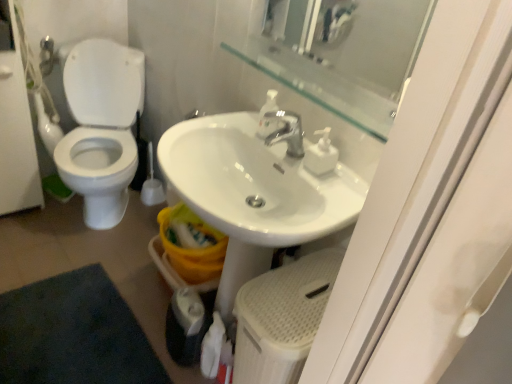
The height and width of the screenshot is (384, 512). What do you see at coordinates (255, 183) in the screenshot?
I see `white glossy sink at center` at bounding box center [255, 183].

Describe the element at coordinates (16, 133) in the screenshot. I see `white glossy screen door at left` at that location.

This screenshot has height=384, width=512. Find the location of `white textured step stool at lower center`. white textured step stool at lower center is located at coordinates (282, 318).

What do you see at coordinates (321, 154) in the screenshot? I see `white plastic soap dispenser at center, which is the 2th soap dispenser in left-to-right order` at bounding box center [321, 154].

Where is `white plastic brush at left`? This screenshot has height=384, width=512. white plastic brush at left is located at coordinates (152, 183).

This screenshot has height=384, width=512. In order to click on translucent plastic soap dispenser at upper center, placed as the first soap dispenser when sorted from left to right in this screenshot , I will do 268,118.

From a real-world perspective, which object rests below the other?

white matte toilet paper at lower center, from a real-world perspective.

Consider the image. Is white plastic brush at left surrounding white matte toilet paper at lower center?

Actually, white matte toilet paper at lower center is outside white plastic brush at left.

Identify the location of sink above the white glossy screen door at left (from a real-world perspective). The width and height of the screenshot is (512, 384). (255, 183).

Considering the relative sizes of white glossy screen door at left and white glossy sink at center in the image provided, is white glossy screen door at left smaller than white glossy sink at center?

Actually, white glossy screen door at left might be larger than white glossy sink at center.

Is white glossy screen door at left in contact with white glossy sink at center?

No, white glossy screen door at left is not beside white glossy sink at center.

Considering the positions of point (9, 140) and point (281, 166), is point (9, 140) closer or farther from the camera than point (281, 166)?

Point (9, 140).

From the image's perspective, relative to white plastic soap dispenser at center, the first soap dispenser viewed from the right, is white glossy toilet at left above or below?

Clearly, from the image's perspective, white glossy toilet at left is above white plastic soap dispenser at center, the first soap dispenser viewed from the right.

Consider the image. Which of these two, white glossy toilet at left or white plastic soap dispenser at center, which is the 2th soap dispenser in left-to-right order, is wider?

white glossy toilet at left.

From a real-world perspective, which is physically below, white glossy toilet at left or white plastic soap dispenser at center, the first soap dispenser viewed from the right?

white glossy toilet at left.

Can you tell me how much white glossy toilet at left and white plastic soap dispenser at center, which is the 2th soap dispenser in left-to-right order, differ in facing direction?

There is a 63.8-degree angle between the facing directions of white glossy toilet at left and white plastic soap dispenser at center, which is the 2th soap dispenser in left-to-right order.

Is white glossy sink at center directly adjacent to transparent glass mirror at upper center?

No, white glossy sink at center is not with transparent glass mirror at upper center.

Could transparent glass mirror at upper center be considered to be inside white glossy sink at center?

No, white glossy sink at center does not contain transparent glass mirror at upper center.

Is white glossy sink at center in front of or behind transparent glass mirror at upper center in the image?

Visually, white glossy sink at center is located in front of transparent glass mirror at upper center.

Considering their positions, is white glossy screen door at left located in front of or behind white plastic brush at left?

white glossy screen door at left is in front of white plastic brush at left.

Would you say white glossy screen door at left is to the left or to the right of white plastic brush at left in the picture?

Based on their positions, white glossy screen door at left is located to the left of white plastic brush at left.

From the image's perspective, is white glossy screen door at left above white plastic brush at left?

Yes, from the image's perspective, white glossy screen door at left is on top of white plastic brush at left.

How many degrees apart are the facing directions of white glossy screen door at left and white plastic brush at left?

The angular difference between white glossy screen door at left and white plastic brush at left is 89.4 degrees.

In the image, is white glossy toilet at left on the left side or the right side of white matte toilet paper at lower center?

Clearly, white glossy toilet at left is on the left of white matte toilet paper at lower center in the image.

You are a GUI agent. You are given a task and a screenshot of the screen. Output one action in this format:
    pyautogui.click(x=<x>, y=<y>)
    Task: Click on the toilet paper located underneath the white glossy toilet at left (from a real-world perspective)
    The image size is (512, 384).
    Given the screenshot: What is the action you would take?
    pyautogui.click(x=216, y=351)

From a real-world perspective, between white glossy toilet at left and white matte toilet paper at lower center, who is vertically higher?

white glossy toilet at left is physically above.

Locate an element on the screen. toilet behind the white glossy sink at center is located at coordinates (101, 127).

Considering the sizes of objects white glossy toilet at left and white glossy sink at center in the image provided, who is bigger, white glossy toilet at left or white glossy sink at center?

Bigger between the two is white glossy toilet at left.

From the picture: From the image's perspective, does white glossy toilet at left appear lower than white glossy sink at center?

Incorrect, from the image's perspective, white glossy toilet at left is higher than white glossy sink at center.

From a real-world perspective, is white glossy toilet at left physically located above or below white glossy sink at center?

white glossy toilet at left is situated lower than white glossy sink at center in the real world.

Find the location of `toilet paper on the right of the white plastic brush at left`. toilet paper on the right of the white plastic brush at left is located at coordinates pyautogui.click(x=216, y=351).

You are a GUI agent. You are given a task and a screenshot of the screen. Output one action in this format:
    pyautogui.click(x=<x>, y=<y>)
    Task: Click on the screen door below the white glossy sink at center (from a real-world perspective)
    
    Given the screenshot: What is the action you would take?
    pyautogui.click(x=16, y=133)

When comparing their distances from transparent glass mirror at upper center, does white glossy toilet at left or white glossy screen door at left seem further?

Among the two, white glossy screen door at left is located further to transparent glass mirror at upper center.

Based on their spatial positions, is transparent glass mirror at upper center or transparent glass mirror at upper center further from white plastic soap dispenser at center, which is the 2th soap dispenser in left-to-right order?

Based on the image, transparent glass mirror at upper center appears to be further to white plastic soap dispenser at center, which is the 2th soap dispenser in left-to-right order.

From the image, which object appears to be farther from transparent glass mirror at upper center, white plastic soap dispenser at center, which is the 2th soap dispenser in left-to-right order, or white glossy screen door at left?

white glossy screen door at left is positioned further to the anchor transparent glass mirror at upper center.

Which object lies nearer to the anchor point white plastic soap dispenser at center, which is the 2th soap dispenser in left-to-right order, white plastic brush at left or white glossy toilet at left?

white glossy toilet at left is positioned closer to the anchor white plastic soap dispenser at center, which is the 2th soap dispenser in left-to-right order.

Based on their spatial positions, is white plastic brush at left or white glossy toilet at left further from transparent glass mirror at upper center?

white plastic brush at left.

Looking at this image, considering their positions, is white matte toilet paper at lower center positioned closer to white glossy screen door at left than white textured step stool at lower center?

Among the two, white matte toilet paper at lower center is located nearer to white glossy screen door at left.

From the image, which object appears to be farther from translucent plastic soap dispenser at upper center, placed as the 2th soap dispenser when sorted from right to left, white glossy sink at center or transparent glass mirror at upper center?

transparent glass mirror at upper center.

When comparing their distances from white textured step stool at lower center, does translucent plastic soap dispenser at upper center, placed as the first soap dispenser when sorted from left to right, or white glossy toilet at left seem closer?

translucent plastic soap dispenser at upper center, placed as the first soap dispenser when sorted from left to right.

Image resolution: width=512 pixels, height=384 pixels. In order to click on balustrade situated between white glossy screen door at left and transparent glass mirror at upper center from left to right in this screenshot , I will do `click(319, 84)`.

The width and height of the screenshot is (512, 384). In order to click on step stool between white glossy screen door at left and transparent glass mirror at upper center from left to right in this screenshot , I will do `click(282, 318)`.

Find the location of a particular element. This screenshot has height=384, width=512. brush that lies between white glossy toilet at left and white matte toilet paper at lower center from top to bottom is located at coordinates (152, 183).

Where is `screen door positioned between white glossy sink at center and white plastic brush at left from near to far`? Image resolution: width=512 pixels, height=384 pixels. screen door positioned between white glossy sink at center and white plastic brush at left from near to far is located at coordinates (16, 133).